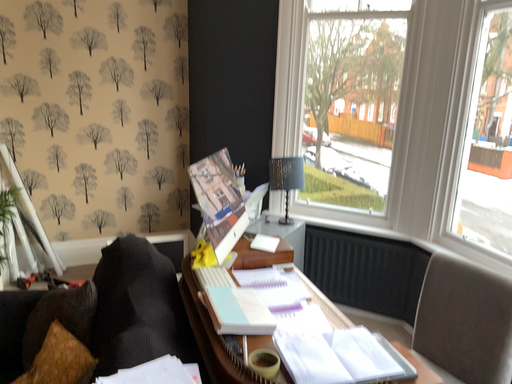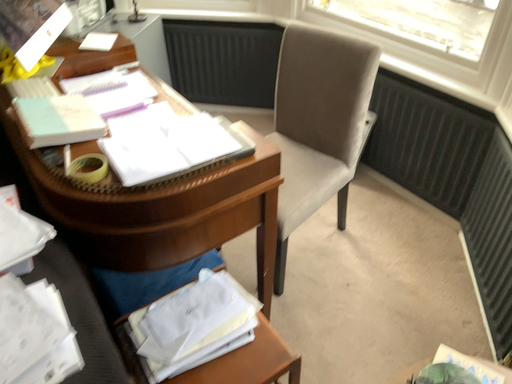
Question: Which way did the camera rotate in the video?

Choices:
 (A) rotated upward
 (B) rotated downward

Answer: (B)